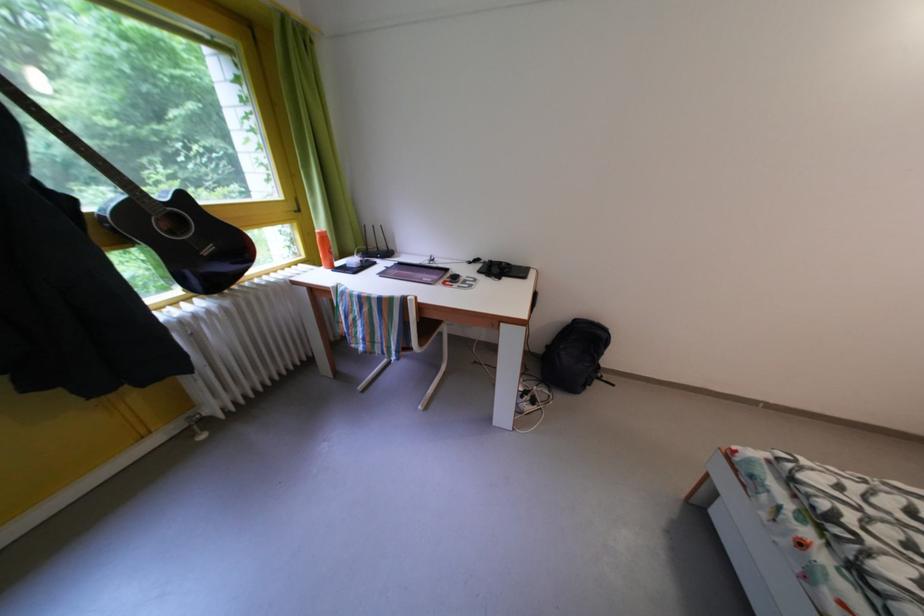
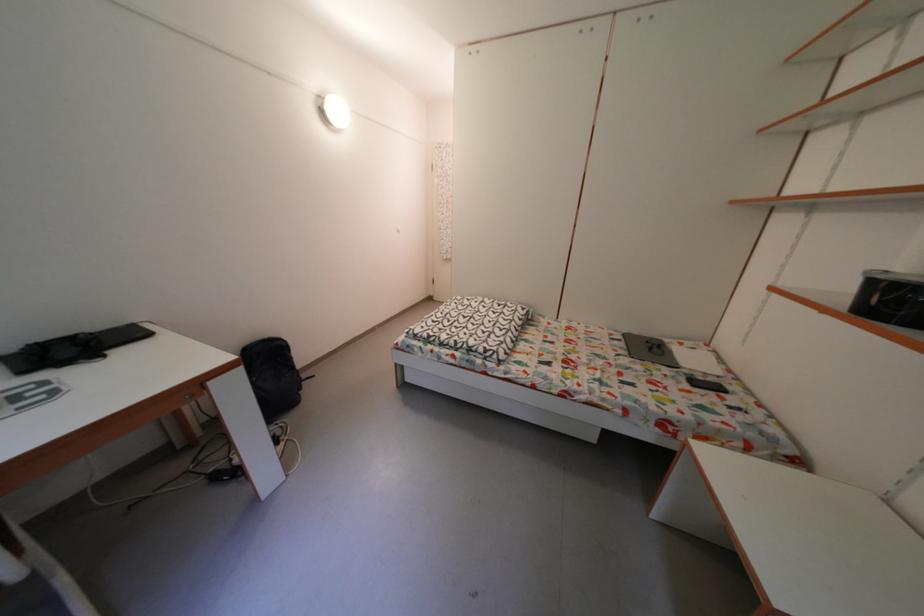
Find the pixel in the second image that matches [494,268] in the first image.

(6, 363)